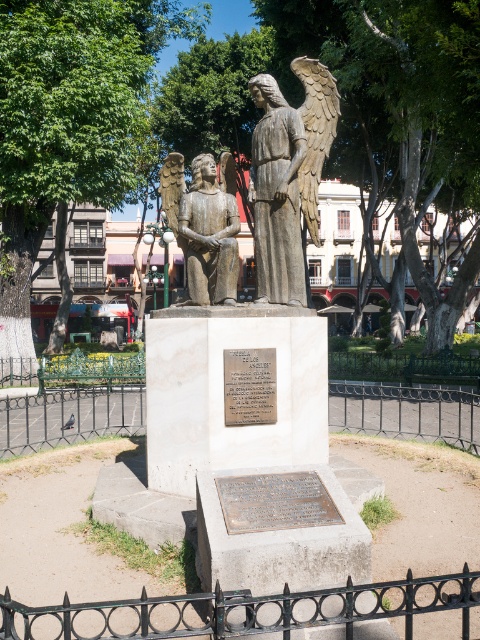
Looking at this image, you are a tourist visiting the statue and want to read the text on the bronze plaque at center. Can you read it clearly from your current position in front of the black wrought iron fence at center?

The bronze plaque at center is behind the black wrought iron fence at center, so you can still read it clearly as the fence is likely transparent enough to see through.

You are a photographer standing in the park where the statue is located. You want to take a photo of the bronze statue of an angel at center without any obstructions. Is the black wrought iron fence at lower center blocking your view of the statue?

The black wrought iron fence at lower center is located below the bronze statue of an angel at center, so it may block the lower part of the statue in your photo. Adjust your angle or position to ensure the entire statue is visible.